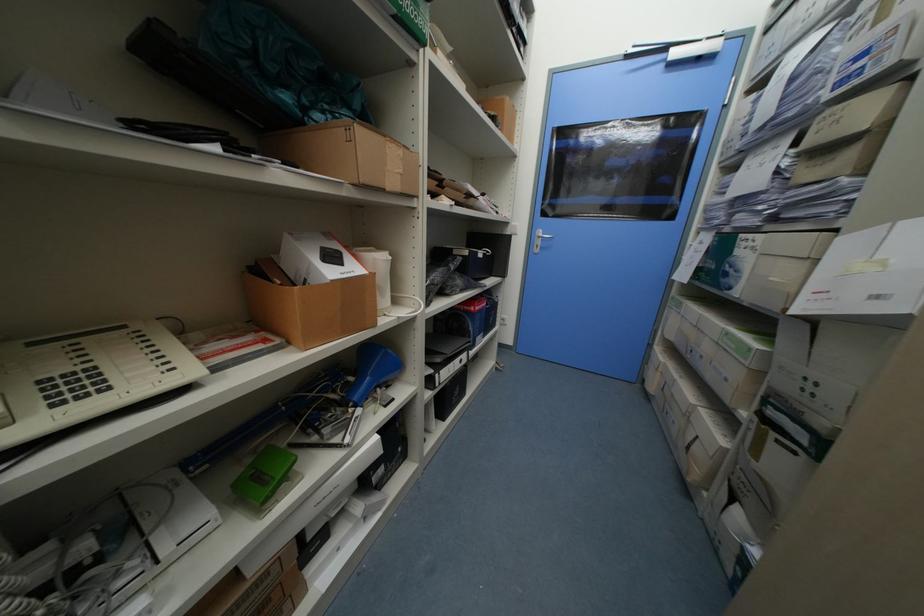
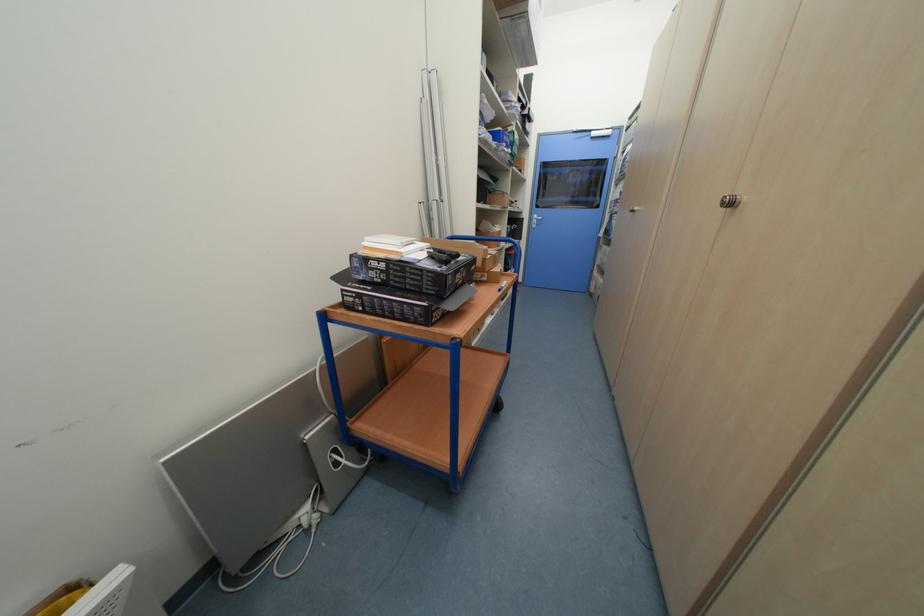
Which direction would the cameraman need to move to produce the second image?

The movement direction of the cameraman is left, backward.